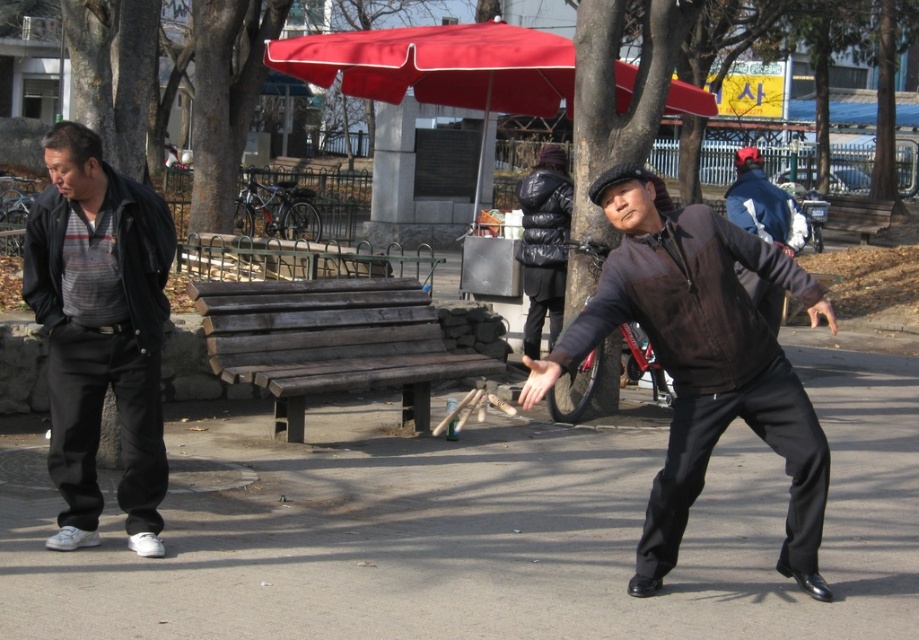
Is brown suede jacket at center smaller than dark brown wood bench at center?

Incorrect, brown suede jacket at center is not smaller in size than dark brown wood bench at center.

Can you confirm if brown suede jacket at center is positioned above dark brown wood bench at center?

Actually, brown suede jacket at center is below dark brown wood bench at center.

Describe the element at coordinates (702, 362) in the screenshot. I see `brown suede jacket at center` at that location.

In order to click on brown suede jacket at center in this screenshot , I will do `click(702, 362)`.

Who is shorter, brown suede jacket at center or dark brown leather jacket at center?

brown suede jacket at center

The width and height of the screenshot is (919, 640). What do you see at coordinates (702, 362) in the screenshot?
I see `brown suede jacket at center` at bounding box center [702, 362].

This screenshot has height=640, width=919. I want to click on brown suede jacket at center, so click(x=702, y=362).

Does red fabric umbrella at upper center appear over dark brown leather jacket at center?

No.

Which is more to the right, red fabric umbrella at upper center or dark brown leather jacket at center?

Positioned to the right is dark brown leather jacket at center.

Which is behind, point (522, 65) or point (752, 189)?

The point (752, 189) is more distant.

The width and height of the screenshot is (919, 640). I want to click on red fabric umbrella at upper center, so click(440, 68).